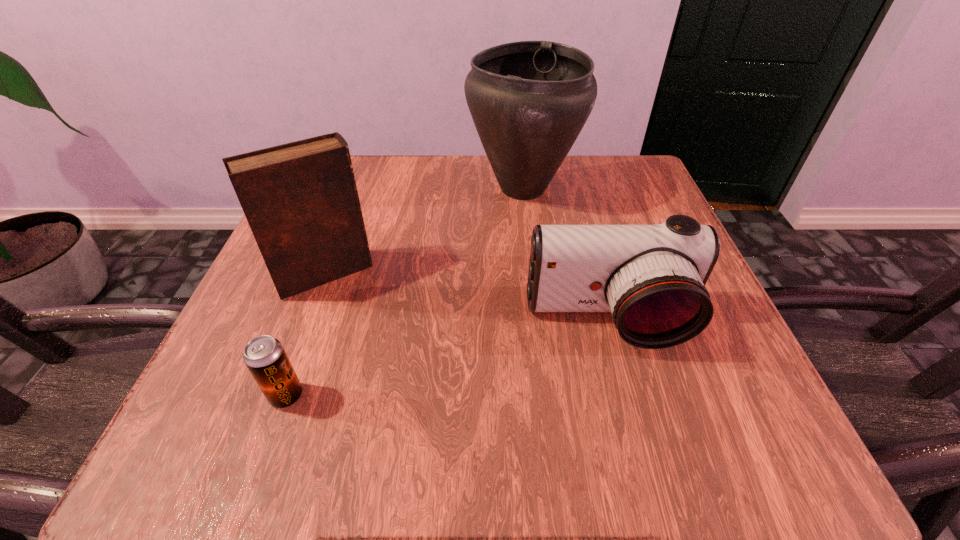
I want to click on object positioned at the far edge, so click(529, 100).

The image size is (960, 540). Identify the location of object located at the near edge. (264, 356).

Image resolution: width=960 pixels, height=540 pixels. What are the coordinates of `Bible located at the left edge` in the screenshot? It's located at (300, 199).

Identify the location of beer can located at the left edge. (264, 356).

You are a GUI agent. You are given a task and a screenshot of the screen. Output one action in this format:
    pyautogui.click(x=<x>, y=<y>)
    Task: Click on the object that is at the right edge
    This screenshot has width=960, height=540.
    Given the screenshot: What is the action you would take?
    pyautogui.click(x=652, y=278)

The image size is (960, 540). In order to click on object situated at the near left corner in this screenshot , I will do `click(264, 356)`.

In order to click on vacant space at the far edge of the desktop in this screenshot , I will do [378, 210].

Where is `vacant space at the near edge of the desktop`? The height and width of the screenshot is (540, 960). vacant space at the near edge of the desktop is located at coordinates (415, 449).

In the image, there is a desktop. At what (x,y) coordinates should I click in order to perform the action: click on vacant space at the left edge. Please return your answer as a coordinate pair (x, y). The image size is (960, 540). Looking at the image, I should click on (305, 397).

The image size is (960, 540). In the image, there is a desktop. Find the location of `vacant area at the far left corner`. vacant area at the far left corner is located at coordinates (359, 192).